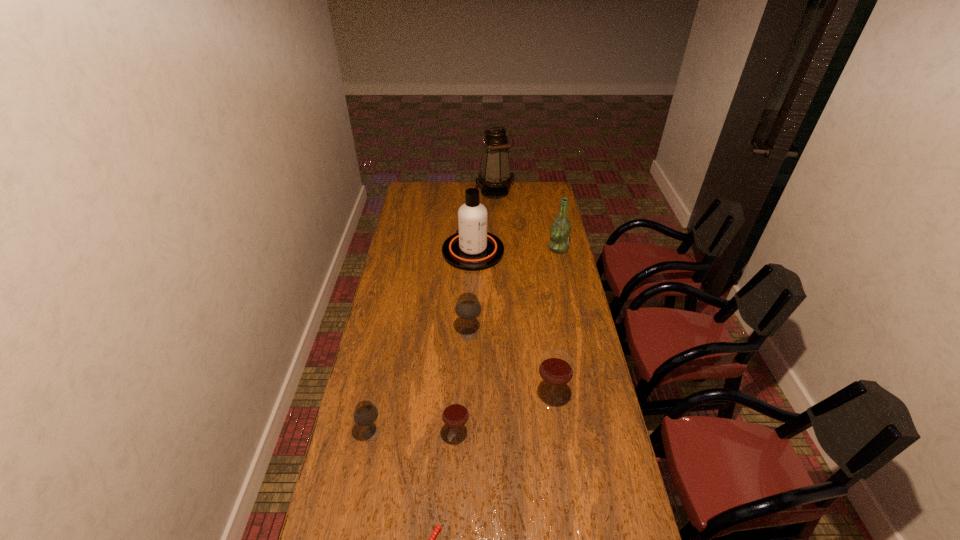
You are a GUI agent. You are given a task and a screenshot of the screen. Output one action in this format:
    pyautogui.click(x=<x>, y=<y>)
    Task: Click on the vacant space at the far left corner of the desktop
    This screenshot has width=960, height=540.
    Given the screenshot: What is the action you would take?
    pyautogui.click(x=419, y=192)

The image size is (960, 540). In the image, there is a desktop. Identify the location of free space at the far right corner. (534, 199).

The width and height of the screenshot is (960, 540). In order to click on unoccupied area between the left red wineglass and the white cleansing agent in this screenshot , I will do pyautogui.click(x=465, y=343).

You are a GUI agent. You are given a task and a screenshot of the screen. Output one action in this format:
    pyautogui.click(x=<x>, y=<y>)
    Task: Click on the vacant point located between the green beer bottle and the nearer red wineglass
    The image size is (960, 540).
    Given the screenshot: What is the action you would take?
    pyautogui.click(x=508, y=342)

You are a GUI agent. You are given a task and a screenshot of the screen. Output one action in this format:
    pyautogui.click(x=<x>, y=<y>)
    Task: Click on the vacant area that lies between the farther gray wineglass and the nearer gray wineglass
    
    Given the screenshot: What is the action you would take?
    pyautogui.click(x=420, y=384)

This screenshot has width=960, height=540. Identify the location of free space between the oil lamp and the fifth farthest object. (523, 295).

Find the location of a particular element. The width and height of the screenshot is (960, 540). object identified as the third closest to the tennis racket is located at coordinates coord(556,367).

The image size is (960, 540). I want to click on object that is the closest to the tennis racket, so click(455, 412).

Identify which wineglass is the second nearest to the fifth farthest object. Please provide its 2D coordinates. Your answer should be formatted as a tuple, i.e. [(x, y)], where the tuple contains the x and y coordinates of a point satisfying the conditions above.

[(468, 307)]

At what (x,y) coordinates should I click in order to perform the action: click on the third closest wineglass to the third tallest object. Please return your answer as a coordinate pair (x, y). The image size is (960, 540). Looking at the image, I should click on (455, 412).